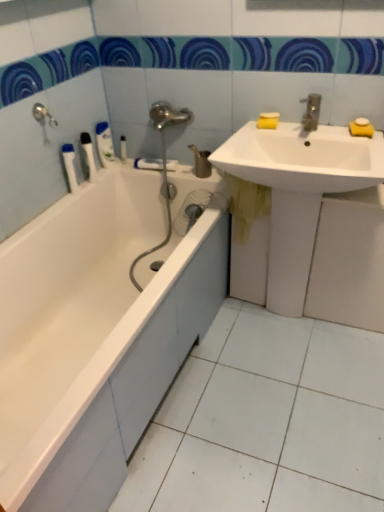
What do you see at coordinates (303, 158) in the screenshot?
I see `white glossy sink at upper right, positioned as the 2th sink in bottom-to-top order` at bounding box center [303, 158].

The image size is (384, 512). What do you see at coordinates (148, 163) in the screenshot? I see `metallic silver towel bar at center` at bounding box center [148, 163].

This screenshot has width=384, height=512. What do you see at coordinates (123, 148) in the screenshot? I see `white plastic tube at upper left, which is counted as the fourth toiletry, starting from the left` at bounding box center [123, 148].

Image resolution: width=384 pixels, height=512 pixels. I want to click on yellow sponge at upper right, marked as the second soap in a right-to-left arrangement, so click(361, 128).

What do you see at coordinates (292, 203) in the screenshot? The width and height of the screenshot is (384, 512). I see `white glossy sink at lower right, arranged as the second sink when viewed from the top` at bounding box center [292, 203].

This screenshot has width=384, height=512. I want to click on metallic silver shower at upper left, so click(43, 114).

Measure the distance from white plastic bottle at left, positioned as the 1th toiletry in left-to-right order, to yellow matte soap at upper right, the 1th soap when ordered from left to right.

white plastic bottle at left, positioned as the 1th toiletry in left-to-right order, is 32.45 inches away from yellow matte soap at upper right, the 1th soap when ordered from left to right.

Is white plastic bottle at left, the 4th toiletry from the right, beside yellow matte soap at upper right, the 1th soap when ordered from left to right?

They are not placed beside each other.

Consider the image. Considering the sizes of objects white plastic bottle at left, the 4th toiletry from the right, and yellow matte soap at upper right, the 1th soap when ordered from left to right, in the image provided, who is smaller, white plastic bottle at left, the 4th toiletry from the right, or yellow matte soap at upper right, the 1th soap when ordered from left to right,?

Smaller between the two is yellow matte soap at upper right, the 1th soap when ordered from left to right.

Is white plastic bottle at left, the 4th toiletry from the right, not inside yellow matte soap at upper right, the 3th soap positioned from the right?

white plastic bottle at left, the 4th toiletry from the right, is positioned outside yellow matte soap at upper right, the 3th soap positioned from the right.

Is metallic silver towel bar at center in front of or behind white plastic bottle at left, the 4th toiletry from the right, in the image?

metallic silver towel bar at center is positioned farther from the viewer than white plastic bottle at left, the 4th toiletry from the right.

Which object is positioned more to the right, metallic silver towel bar at center or white plastic bottle at left, positioned as the 1th toiletry in left-to-right order?

Positioned to the right is metallic silver towel bar at center.

Consider the image. Is white plastic bottle at left, the 4th toiletry from the right, a part of metallic silver towel bar at center?

No, metallic silver towel bar at center does not contain white plastic bottle at left, the 4th toiletry from the right.

Are metallic silver towel bar at center and white plastic bottle at left, positioned as the 1th toiletry in left-to-right order, making contact?

No, metallic silver towel bar at center is not next to white plastic bottle at left, positioned as the 1th toiletry in left-to-right order.

Is metallic faucet at upper right positioned with its back to white glossy sink at lower right, the 1th sink when ordered from bottom to top?

No, metallic faucet at upper right is not facing away from white glossy sink at lower right, the 1th sink when ordered from bottom to top.

Looking at the image, does metallic faucet at upper right seem bigger or smaller compared to white glossy sink at lower right, arranged as the second sink when viewed from the top?

In the image, metallic faucet at upper right appears to be smaller than white glossy sink at lower right, arranged as the second sink when viewed from the top.

Is metallic faucet at upper right with white glossy sink at lower right, the 1th sink when ordered from bottom to top?

No, metallic faucet at upper right is not touching white glossy sink at lower right, the 1th sink when ordered from bottom to top.

Based on their positions, is metallic silver shower at upper left located to the left or right of white plastic toilet brush at upper left, positioned as the 3th toiletry in left-to-right order?

In the image, metallic silver shower at upper left appears on the left side of white plastic toilet brush at upper left, positioned as the 3th toiletry in left-to-right order.

Is metallic silver shower at upper left next to white plastic toilet brush at upper left, the second toiletry from the right?

No.

Is metallic silver shower at upper left positioned behind white plastic toilet brush at upper left, positioned as the 3th toiletry in left-to-right order?

That is False.

From a real-world perspective, relative to white plastic toilet brush at upper left, the second toiletry from the right, is metallic silver shower at upper left vertically above or below?

From a real-world perspective, metallic silver shower at upper left is physically above white plastic toilet brush at upper left, the second toiletry from the right.

In the scene shown: Considering the relative sizes of white plastic tube at upper left, which is counted as the fourth toiletry, starting from the left, and metallic silver shower at upper left in the image provided, is white plastic tube at upper left, which is counted as the fourth toiletry, starting from the left, smaller than metallic silver shower at upper left?

Correct, white plastic tube at upper left, which is counted as the fourth toiletry, starting from the left, occupies less space than metallic silver shower at upper left.

Is white plastic tube at upper left, which is the first toiletry in right-to-left order, oriented away from metallic silver shower at upper left?

That's not correct — white plastic tube at upper left, which is the first toiletry in right-to-left order, is not looking away from metallic silver shower at upper left.

Is white plastic tube at upper left, which is counted as the fourth toiletry, starting from the left, inside the boundaries of metallic silver shower at upper left, or outside?

white plastic tube at upper left, which is counted as the fourth toiletry, starting from the left, is spatially situated outside metallic silver shower at upper left.

Would you say white plastic tube at upper left, which is counted as the fourth toiletry, starting from the left, is to the left or to the right of metallic silver shower at upper left in the picture?

In the image, white plastic tube at upper left, which is counted as the fourth toiletry, starting from the left, appears on the right side of metallic silver shower at upper left.

Is white glossy sink at upper right, positioned as the 2th sink in bottom-to-top order, touching yellow matte soap at upper right, the 1th soap when ordered from left to right?

No, white glossy sink at upper right, positioned as the 2th sink in bottom-to-top order, is not making contact with yellow matte soap at upper right, the 1th soap when ordered from left to right.

From a real-world perspective, which is physically below, white glossy sink at upper right, which is the first sink in top-to-bottom order, or yellow matte soap at upper right, the 3th soap positioned from the right?

white glossy sink at upper right, which is the first sink in top-to-bottom order.

Could you tell me if white glossy sink at upper right, positioned as the 2th sink in bottom-to-top order, is facing yellow matte soap at upper right, the 3th soap positioned from the right?

No, white glossy sink at upper right, positioned as the 2th sink in bottom-to-top order, is not turned towards yellow matte soap at upper right, the 3th soap positioned from the right.

How many degrees apart are the facing directions of white glossy sink at upper right, positioned as the 2th sink in bottom-to-top order, and yellow matte soap at upper right, the 1th soap when ordered from left to right?

The angle between the facing direction of white glossy sink at upper right, positioned as the 2th sink in bottom-to-top order, and the facing direction of yellow matte soap at upper right, the 1th soap when ordered from left to right, is 6.61 degrees.

In terms of height, does yellow sponge at upper right, which is the 2th soap from left to right, look taller or shorter compared to yellow sponge at upper right, which appears as the 3th soap when viewed from the left?

Clearly, yellow sponge at upper right, which is the 2th soap from left to right, is taller compared to yellow sponge at upper right, which appears as the 3th soap when viewed from the left.

Locate an element on the screen. The image size is (384, 512). soap that appears in front of the yellow sponge at upper right, the first soap positioned from the right is located at coordinates (361, 128).

Is yellow sponge at upper right, marked as the second soap in a right-to-left arrangement, next to yellow sponge at upper right, which appears as the 3th soap when viewed from the left?

Yes.

Identify the location of the 2nd soap directly above the white plastic bottle at left, positioned as the 1th toiletry in left-to-right order (from a real-world perspective). The height and width of the screenshot is (512, 384). (268, 120).

Identify the location of the 4th toiletry counting from the left of the metallic silver towel bar at center. The image size is (384, 512). (70, 166).

Consider the image. Estimate the real-world distances between objects in this image. Which object is further from white plastic tube at upper left, which is counted as the fourth toiletry, starting from the left, white glossy bathtub at left or metallic faucet at upper right?

metallic faucet at upper right.

Which object lies nearer to the anchor point white plastic bottle at left, the 4th toiletry from the right, metallic silver shower at upper left or metallic faucet at upper right?

metallic silver shower at upper left is closer to white plastic bottle at left, the 4th toiletry from the right.

Based on their spatial positions, is white glossy sink at lower right, the 1th sink when ordered from bottom to top, or metallic silver towel bar at center further from white plastic toothbrush at left, which ranks as the 2th toiletry in left-to-right order?

Based on the image, white glossy sink at lower right, the 1th sink when ordered from bottom to top, appears to be further to white plastic toothbrush at left, which ranks as the 2th toiletry in left-to-right order.

Based on the photo, estimate the real-world distances between objects in this image. Which object is closer to white plastic toothbrush at left, which ranks as the 2th toiletry in left-to-right order, white plastic toilet brush at upper left, positioned as the 3th toiletry in left-to-right order, or white glossy bathtub at left?

white plastic toilet brush at upper left, positioned as the 3th toiletry in left-to-right order.

Which object lies nearer to the anchor point yellow sponge at upper right, marked as the second soap in a right-to-left arrangement, metallic faucet at upper right or white plastic tube at upper left, which is the first toiletry in right-to-left order?

metallic faucet at upper right is positioned closer to the anchor yellow sponge at upper right, marked as the second soap in a right-to-left arrangement.

Considering their positions, is white glossy bathtub at left positioned further to yellow matte soap at upper right, the 1th soap when ordered from left to right, than yellow sponge at upper right, the first soap positioned from the right?

white glossy bathtub at left is positioned further to the anchor yellow matte soap at upper right, the 1th soap when ordered from left to right.

Considering their positions, is metallic faucet at upper right positioned closer to white plastic toilet brush at upper left, the second toiletry from the right, than metallic silver shower at upper left?

metallic silver shower at upper left is positioned closer to the anchor white plastic toilet brush at upper left, the second toiletry from the right.

Looking at the image, which one is located closer to yellow matte soap at upper right, the 3th soap positioned from the right, white plastic tube at upper left, which is counted as the fourth toiletry, starting from the left, or metallic faucet at upper right?

metallic faucet at upper right lies closer to yellow matte soap at upper right, the 3th soap positioned from the right, than the other object.

Find the location of a particular element. This screenshot has height=512, width=384. towel bar between white plastic toilet brush at upper left, the second toiletry from the right, and white glossy sink at upper right, which is the first sink in top-to-bottom order, from left to right is located at coordinates (148, 163).

Identify the location of sink between white plastic toothbrush at left, which ranks as the 2th toiletry in left-to-right order, and white glossy sink at lower right, the 1th sink when ordered from bottom to top, from left to right. This screenshot has width=384, height=512. (303, 158).

Identify the location of sink between white plastic toothbrush at left, which ranks as the 2th toiletry in left-to-right order, and metallic faucet at upper right from left to right. The height and width of the screenshot is (512, 384). (303, 158).

Locate an element on the screen. The image size is (384, 512). soap between metallic faucet at upper right and yellow sponge at upper right, which appears as the 3th soap when viewed from the left, from left to right is located at coordinates (361, 128).